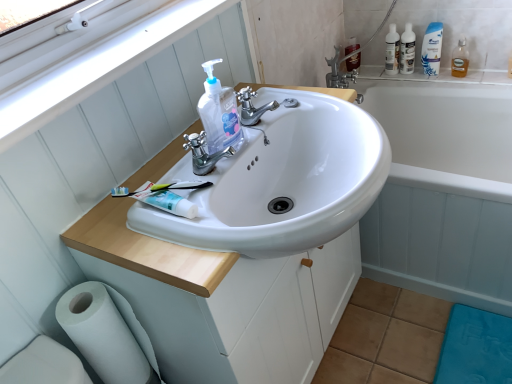
Find the location of `free space in front of white glossy shampoo bottle at upper right, the first cleaning product when ordered from top to bottom`. free space in front of white glossy shampoo bottle at upper right, the first cleaning product when ordered from top to bottom is located at coordinates (443, 73).